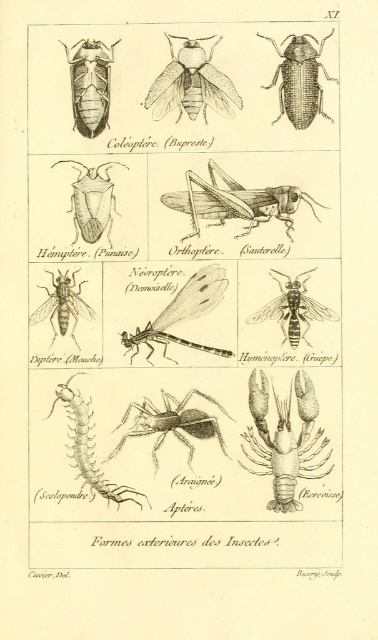
Does brown matte spider at center come behind translucent yellowishmaterial/texturefly at center-left?

No.

Does brown matte spider at center have a greater height compared to translucent yellowishmaterial/texturefly at center-left?

Indeed, brown matte spider at center has a greater height compared to translucent yellowishmaterial/texturefly at center-left.

Is point (227, 456) positioned before point (75, 292)?

Yes, it is.

You are a GUI agent. You are given a task and a screenshot of the screen. Output one action in this format:
    pyautogui.click(x=<x>, y=<y>)
    Task: Click on the brown matte spider at center
    The image size is (378, 640).
    Given the screenshot: What is the action you would take?
    pyautogui.click(x=171, y=422)

Is point (309, 124) positioned before point (72, 320)?

Yes, it is in front of point (72, 320).

Can you confirm if black matte beetle at upper right is positioned to the left of translucent yellowishmaterial/texturefly at center-left?

In fact, black matte beetle at upper right is to the right of translucent yellowishmaterial/texturefly at center-left.

Does point (314, 92) lie in front of point (57, 301)?

That is True.

The width and height of the screenshot is (378, 640). Find the location of `black matte beetle at upper right`. black matte beetle at upper right is located at coordinates (300, 80).

Does translucent yellowish lobster at lower right have a greater width compared to yellow striped wasp at center?

No.

Is translucent yellowish lobster at lower right thinner than yellow striped wasp at center?

Yes, translucent yellowish lobster at lower right is thinner than yellow striped wasp at center.

What are the coordinates of `translucent yellowish lobster at lower right` in the screenshot? It's located at click(x=285, y=440).